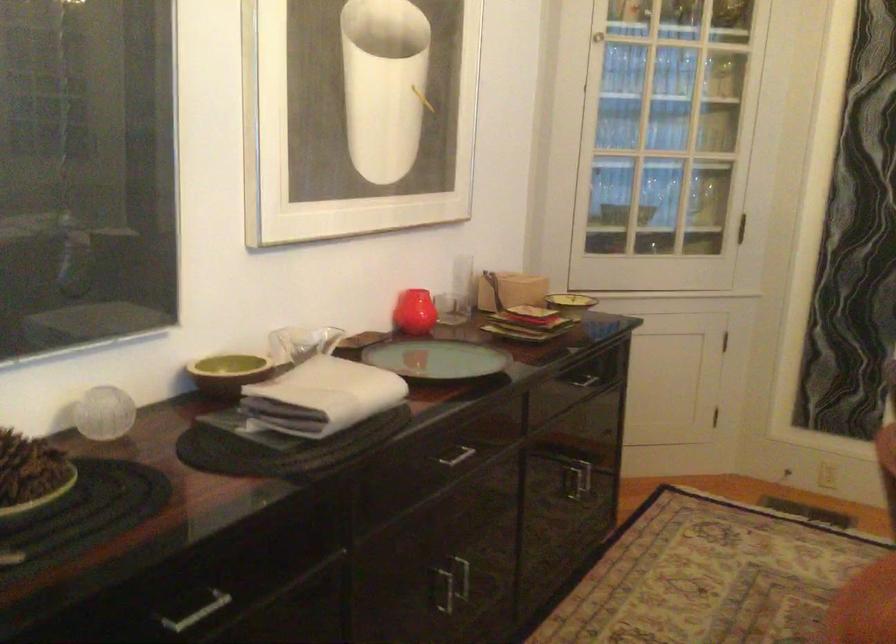
This screenshot has width=896, height=644. In order to click on tall drinking glass in this screenshot , I will do `click(721, 77)`.